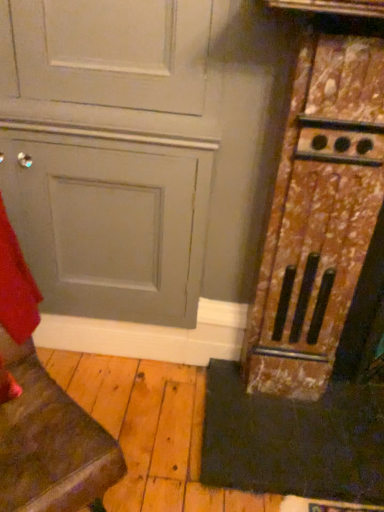
The width and height of the screenshot is (384, 512). I want to click on vacant region above black rubber doormat at lower right (from a real-world perspective), so click(x=309, y=423).